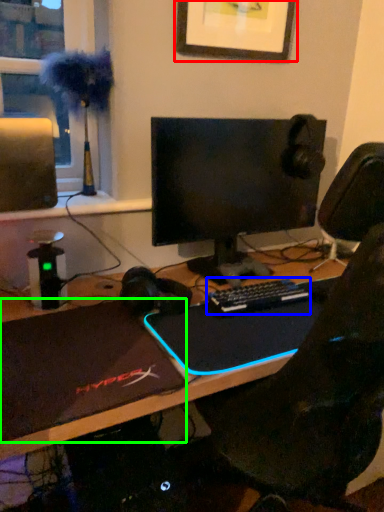
Question: Based on their relative distances, which object is nearer to picture frame (highlighted by a red box)? Choose from computer keyboard (highlighted by a blue box) and laptop (highlighted by a green box).

Choices:
 (A) computer keyboard
 (B) laptop

Answer: (A)